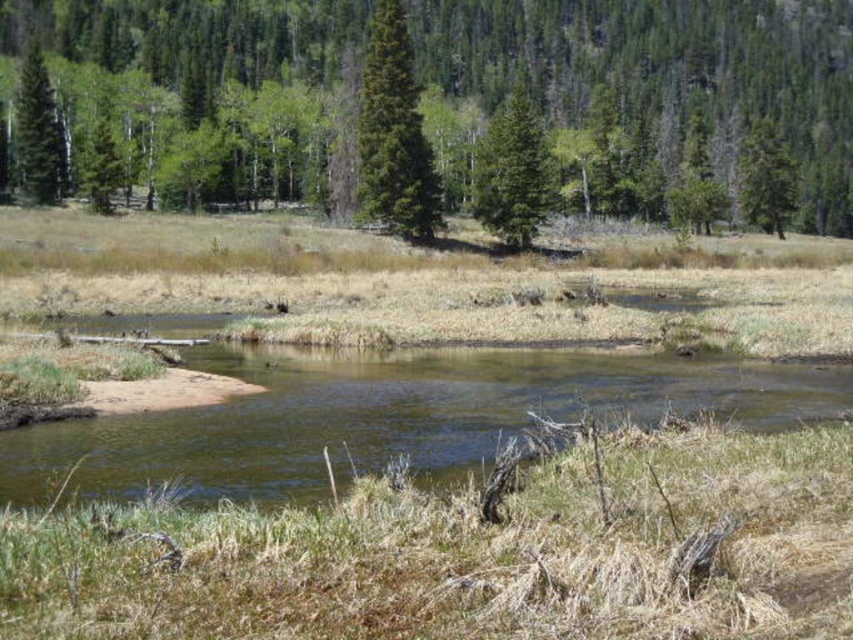
Does green matte tree at upper center have a lesser width compared to green matte tree at left?

Incorrect, green matte tree at upper center's width is not less than green matte tree at left's.

Between point (202, 28) and point (39, 144), which one is positioned behind?

The point (202, 28) is behind.

Find the location of a particular element. The image size is (853, 640). green matte tree at upper center is located at coordinates (666, 74).

Where is `green matte tree at upper center`? This screenshot has width=853, height=640. green matte tree at upper center is located at coordinates (666, 74).

Which is below, green matte evergreen tree at center or green matte tree at center?

green matte evergreen tree at center is lower down.

Can you confirm if green matte evergreen tree at center is taller than green matte tree at center?

In fact, green matte evergreen tree at center may be shorter than green matte tree at center.

Which is behind, point (376, 198) or point (535, 134)?

The point (535, 134) is behind.

Identify the location of green matte evergreen tree at center. (393, 134).

Which is more to the left, green grassy river at center or green matte tree at center?

green grassy river at center is more to the left.

Can you confirm if green grassy river at center is smaller than green matte tree at center?

Correct, green grassy river at center occupies less space than green matte tree at center.

Which is in front, point (318, 355) or point (503, 172)?

Point (318, 355)

Where is `green grassy river at center`? The height and width of the screenshot is (640, 853). green grassy river at center is located at coordinates (392, 416).